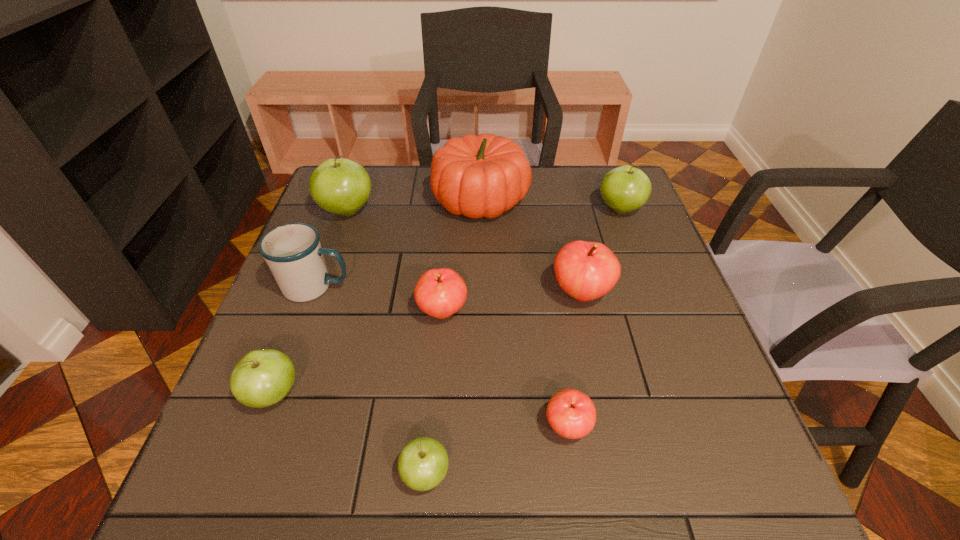
Identify the location of pumpkin at the far edge. (479, 176).

Identify the location of object that is at the near edge. The width and height of the screenshot is (960, 540). (423, 463).

What are the coordinates of `mug that is at the left edge` in the screenshot? It's located at (293, 252).

Locate an element on the screen. object that is at the far left corner is located at coordinates (340, 186).

This screenshot has width=960, height=540. Identify the location of object that is at the far right corner. (624, 189).

Where is `vacant area at the far edge`? vacant area at the far edge is located at coordinates (418, 195).

In the image, there is a desktop. Find the location of `free space at the near edge`. free space at the near edge is located at coordinates (550, 475).

The image size is (960, 540). In order to click on free space at the left edge of the desktop in this screenshot , I will do `click(324, 316)`.

Find the location of `free location at the right edge`. free location at the right edge is located at coordinates (645, 303).

The image size is (960, 540). Identify the location of vacant space at the far right corner of the desktop. click(604, 204).